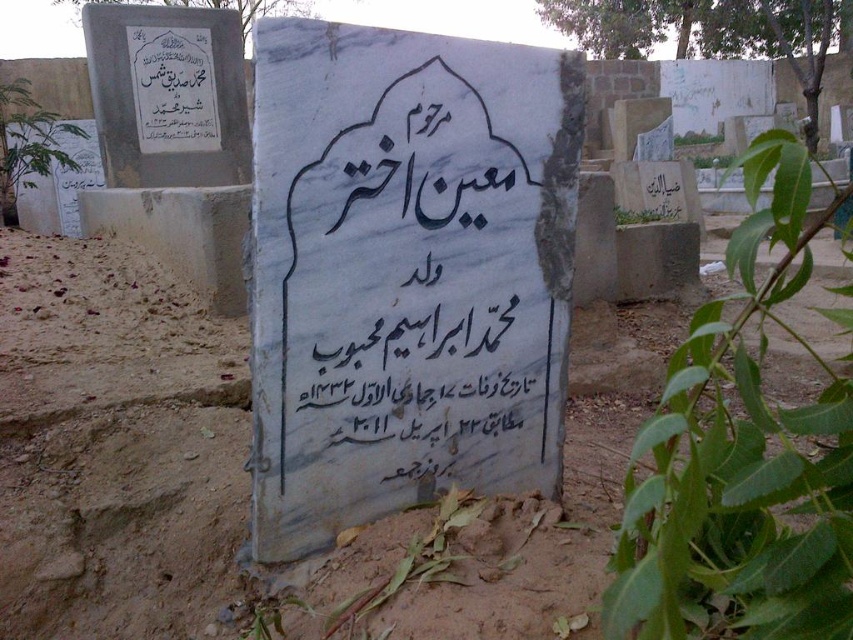
Question: Among these points, which one is nearest to the camera?

Choices:
 (A) (335, 266)
 (B) (120, 506)

Answer: (A)

Question: Which point is closer to the camera taking this photo?

Choices:
 (A) (451, 176)
 (B) (378, 560)

Answer: (B)

Question: Observing the image, what is the correct spatial positioning of white marble gravestone at center in reference to brown sandy dirt at center?

Choices:
 (A) below
 (B) above

Answer: (B)

Question: Is white marble gravestone at center bigger than brown sandy dirt at center?

Choices:
 (A) no
 (B) yes

Answer: (A)

Question: Which object is farther from the camera taking this photo?

Choices:
 (A) white marble gravestone at center
 (B) brown sandy dirt at center

Answer: (B)

Question: Can you confirm if white marble gravestone at center is bigger than brown sandy dirt at center?

Choices:
 (A) yes
 (B) no

Answer: (B)